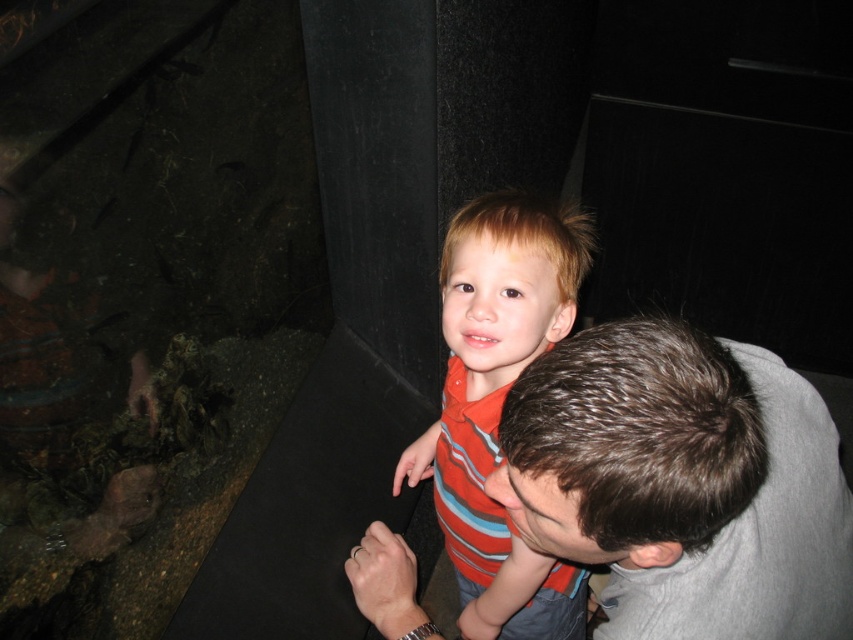
Question: Which point appears farthest from the camera in this image?

Choices:
 (A) (602, 497)
 (B) (462, 330)

Answer: (B)

Question: Does gray smooth shirt at upper right have a larger size compared to striped cotton shirt at center?

Choices:
 (A) no
 (B) yes

Answer: (A)

Question: Which of the following is the closest to the observer?

Choices:
 (A) gray smooth shirt at upper right
 (B) striped cotton shirt at center

Answer: (A)

Question: Does gray smooth shirt at upper right have a greater width compared to striped cotton shirt at center?

Choices:
 (A) yes
 (B) no

Answer: (A)

Question: Is gray smooth shirt at upper right above striped cotton shirt at center?

Choices:
 (A) no
 (B) yes

Answer: (A)